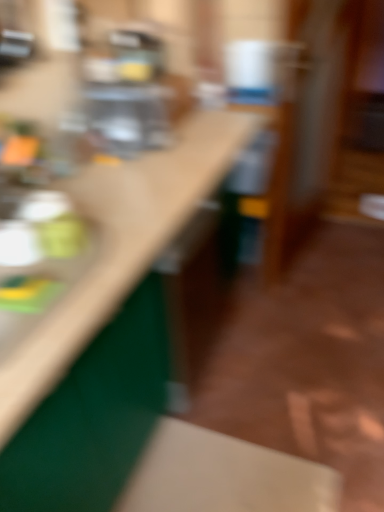
The height and width of the screenshot is (512, 384). Find the location of `vacant region to the right of wooden at left`. vacant region to the right of wooden at left is located at coordinates (x=258, y=362).